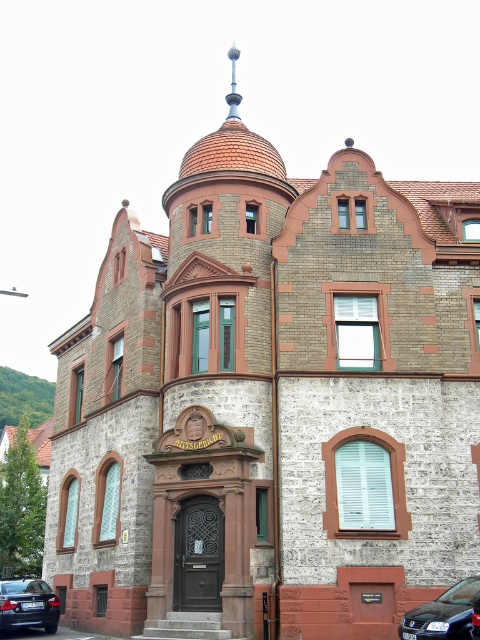
The height and width of the screenshot is (640, 480). Describe the element at coordinates (443, 614) in the screenshot. I see `black glossy car at lower right` at that location.

Is point (443, 604) more distant than point (16, 616)?

That is False.

Where is `black glossy car at lower right`? The image size is (480, 640). black glossy car at lower right is located at coordinates (443, 614).